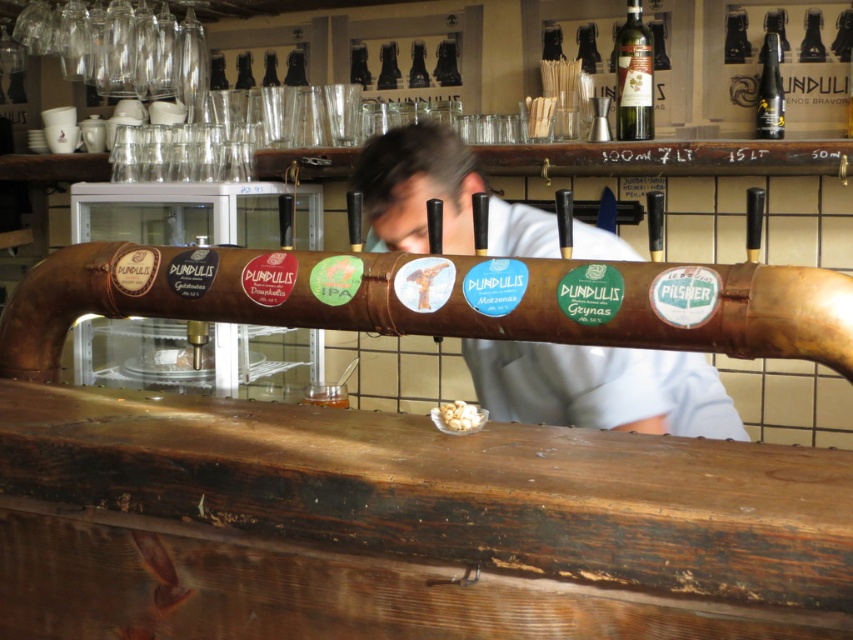
You are a bartender preparing to serve a drink. You notice a white fabric shirt at center and a shiny dark glass bottle at upper right. Which object is taller from your viewpoint?

The white fabric shirt at center is taller than the shiny dark glass bottle at upper right according to the description.

You are a bartender preparing to serve a drink. You notice the white fabric shirt at center and the green glass bottle at upper right. Which object is taller?

The white fabric shirt at center is taller than the green glass bottle at upper right.

What is the relationship between the width of the white fabric shirt at center and the green glass bottle at upper right?

The white fabric shirt at center might be wider than green glass bottle at upper right.